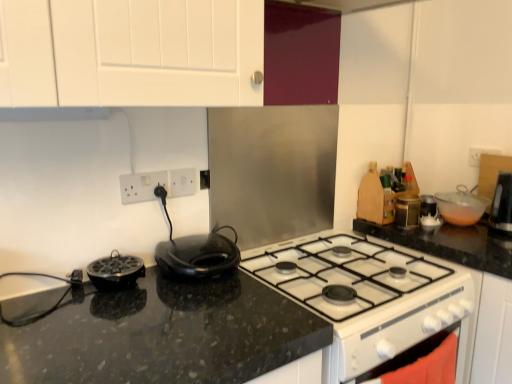
Question: Is the position of black granite countertop at center more distant than that of black matte waffle maker at lower left, which ranks as the third kitchen appliance in back-to-front order?

Choices:
 (A) no
 (B) yes

Answer: (B)

Question: Is black granite countertop at center smaller than black matte waffle maker at lower left, arranged as the 3th kitchen appliance when viewed from the right?

Choices:
 (A) no
 (B) yes

Answer: (A)

Question: Can you confirm if black granite countertop at center is thinner than black matte waffle maker at lower left, arranged as the 3th kitchen appliance when viewed from the right?

Choices:
 (A) no
 (B) yes

Answer: (A)

Question: Considering the relative sizes of black granite countertop at center and black matte waffle maker at lower left, arranged as the 3th kitchen appliance when viewed from the right, in the image provided, is black granite countertop at center shorter than black matte waffle maker at lower left, arranged as the 3th kitchen appliance when viewed from the right,?

Choices:
 (A) yes
 (B) no

Answer: (B)

Question: Does black granite countertop at center appear on the right side of black matte waffle maker at lower left, which is the first kitchen appliance from front to back?

Choices:
 (A) yes
 (B) no

Answer: (A)

Question: Is black granite countertop at center next to black matte waffle maker at lower left, which ranks as the third kitchen appliance in back-to-front order, and touching it?

Choices:
 (A) no
 (B) yes

Answer: (A)

Question: Can you confirm if transparent plastic bowl at upper right, which appears as the 3th kitchen appliance when viewed from the front, is positioned to the left of black granite countertop at center?

Choices:
 (A) yes
 (B) no

Answer: (B)

Question: From the image's perspective, would you say transparent plastic bowl at upper right, arranged as the first kitchen appliance when viewed from the right, is shown under black granite countertop at center?

Choices:
 (A) no
 (B) yes

Answer: (A)

Question: Is transparent plastic bowl at upper right, arranged as the first kitchen appliance when viewed from the right, smaller than black granite countertop at center?

Choices:
 (A) no
 (B) yes

Answer: (B)

Question: Could you tell me if transparent plastic bowl at upper right, which appears as the 3th kitchen appliance when viewed from the front, is turned towards black granite countertop at center?

Choices:
 (A) no
 (B) yes

Answer: (A)

Question: Is the position of transparent plastic bowl at upper right, arranged as the first kitchen appliance when viewed from the right, less distant than that of black granite countertop at center?

Choices:
 (A) no
 (B) yes

Answer: (A)

Question: Is transparent plastic bowl at upper right, the first kitchen appliance in the back-to-front sequence, surrounding black granite countertop at center?

Choices:
 (A) yes
 (B) no

Answer: (B)

Question: Considering the relative sizes of black granite countertop at center and white glossy oven at lower right in the image provided, is black granite countertop at center taller than white glossy oven at lower right?

Choices:
 (A) no
 (B) yes

Answer: (A)